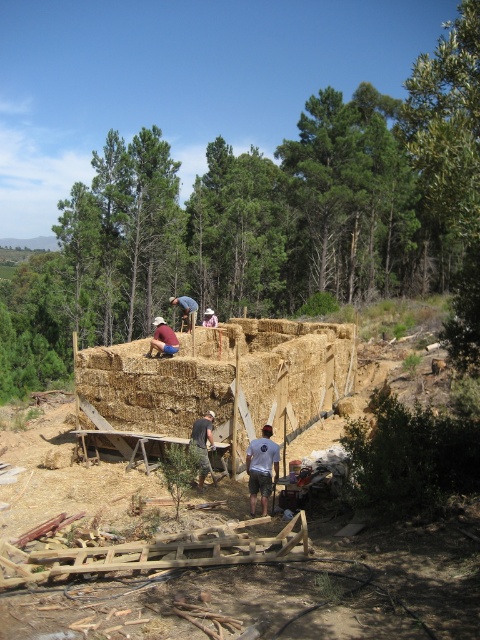
Looking at this image, can you confirm if matte brown straw bale at center is thinner than blue denim shorts at center?

In fact, matte brown straw bale at center might be wider than blue denim shorts at center.

Does matte brown straw bale at center come in front of blue denim shorts at center?

Yes, matte brown straw bale at center is closer to the viewer.

You are a GUI agent. You are given a task and a screenshot of the screen. Output one action in this format:
    pyautogui.click(x=<x>, y=<y>)
    Task: Click on the matte brown straw bale at center
    This screenshot has height=640, width=480.
    Given the screenshot: What is the action you would take?
    pyautogui.click(x=163, y=339)

Is point (247, 449) positioned behind point (194, 316)?

No, (247, 449) is closer to viewer.

Does white cotton t-shirt at center lie behind blue denim shorts at center?

No, it is not.

Who is more distant from viewer, (274, 449) or (192, 312)?

The point (192, 312) is more distant.

At what (x,y) coordinates should I click in order to perform the action: click on white cotton t-shirt at center. Please return your answer as a coordinate pair (x, y). The image size is (480, 640). Looking at the image, I should click on (262, 467).

Can you confirm if dark gray fabric shirt at center is shorter than brown straw hat at upper center?

Correct, dark gray fabric shirt at center is not as tall as brown straw hat at upper center.

Does dark gray fabric shirt at center have a lesser width compared to brown straw hat at upper center?

Correct, dark gray fabric shirt at center's width is less than brown straw hat at upper center's.

This screenshot has height=640, width=480. Identify the location of dark gray fabric shirt at center. (203, 444).